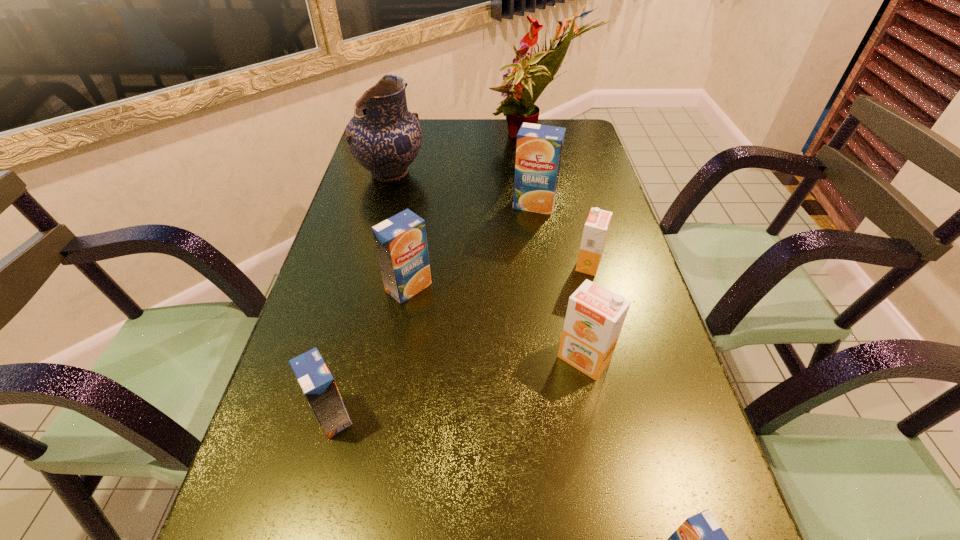
Where is `free space between the blue pottery and the tallest orange_juice`? The height and width of the screenshot is (540, 960). free space between the blue pottery and the tallest orange_juice is located at coordinates (463, 189).

The height and width of the screenshot is (540, 960). What are the coordinates of `empty space between the third nearest blue orange_juice and the smaller orange orange juice` in the screenshot? It's located at (498, 276).

At what (x,y) coordinates should I click in order to perform the action: click on vacant space that is in between the third farthest blue orange_juice and the smaller orange orange juice. Please return your answer as a coordinate pair (x, y). Image resolution: width=960 pixels, height=540 pixels. Looking at the image, I should click on (460, 340).

Where is `vacant area that lies between the third farthest object and the farther orange orange juice`? The image size is (960, 540). vacant area that lies between the third farthest object and the farther orange orange juice is located at coordinates (562, 234).

You are a GUI agent. You are given a task and a screenshot of the screen. Output one action in this format:
    pyautogui.click(x=<x>, y=<y>)
    Task: Click on the empty space that is in between the biggest blue orange_juice and the second nearest object
    The width and height of the screenshot is (960, 540).
    Given the screenshot: What is the action you would take?
    pyautogui.click(x=433, y=310)

Locate an element on the screen. Image resolution: width=960 pixels, height=540 pixels. the fifth closest object to the sixth farthest object is located at coordinates (539, 148).

The image size is (960, 540). What are the coordinates of `object that stands as the closest to the nearest blue orange_juice` in the screenshot? It's located at (595, 316).

Identify which orange_juice is the fifth nearest to the pottery. Please provide its 2D coordinates. Your answer should be formatted as a tuple, i.e. [(x, y)], where the tuple contains the x and y coordinates of a point satisfying the conditions above.

[(314, 377)]

The image size is (960, 540). What are the coordinates of `orange_juice that is the fifth closest to the bouquet` in the screenshot? It's located at (314, 377).

Where is `blue orange_juice that is the fourth nearest to the farther orange orange juice`? blue orange_juice that is the fourth nearest to the farther orange orange juice is located at coordinates (314, 377).